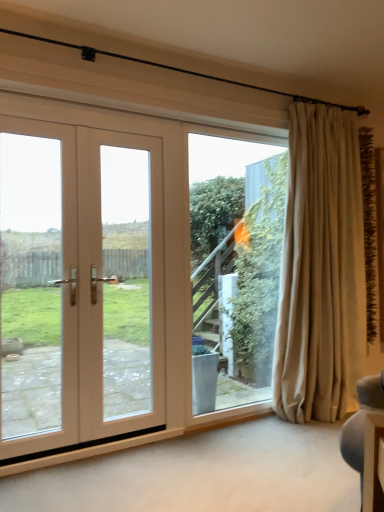
In order to click on white wood door at left in this screenshot , I will do `click(106, 277)`.

The width and height of the screenshot is (384, 512). Describe the element at coordinates (106, 277) in the screenshot. I see `white wood door at left` at that location.

This screenshot has height=512, width=384. Describe the element at coordinates (236, 264) in the screenshot. I see `transparent glass window at center` at that location.

Image resolution: width=384 pixels, height=512 pixels. I want to click on white wood door at left, so click(x=106, y=277).

Is beige fabric curtain at right bigger than transparent glass window at center?

Yes.

Can you confirm if beige fabric curtain at right is taller than transparent glass window at center?

Yes.

Is transparent glass window at center completely or partially inside beige fabric curtain at right?

No, beige fabric curtain at right does not contain transparent glass window at center.

Is white wood door at left bigger than transparent glass window at center?

Yes.

Find the location of a particular element. window screen located below the white wood door at left (from the image's perspective) is located at coordinates (236, 264).

Is white wood door at left facing towards transparent glass window at center?

No, white wood door at left is not aimed at transparent glass window at center.

From the picture: From the image's perspective, which is above, white wood door at left or transparent glass window at center?

From the image's view, white wood door at left is above.

Is beige fabric curtain at right shorter than white wood door at left?

No, beige fabric curtain at right is not shorter than white wood door at left.

Does point (311, 195) come closer to viewer compared to point (68, 368)?

No, (311, 195) is behind (68, 368).

From the image's perspective, between beige fabric curtain at right and white wood door at left, who is located below?

white wood door at left.

Can you confirm if beige fabric curtain at right is smaller than white wood door at left?

Actually, beige fabric curtain at right might be larger than white wood door at left.

This screenshot has width=384, height=512. What are the coordinates of `door in front of the transparent glass window at center` in the screenshot? It's located at (106, 277).

From the image's perspective, is transparent glass window at center above or below white wood door at left?

From the image's perspective, transparent glass window at center appears below white wood door at left.

Consider the image. Does transparent glass window at center contain white wood door at left?

No, white wood door at left is not surrounded by transparent glass window at center.

Is the position of transparent glass window at center less distant than that of white wood door at left?

No, transparent glass window at center is further to the viewer.

From a real-world perspective, between transparent glass window at center and beige fabric curtain at right, who is vertically lower?

transparent glass window at center, from a real-world perspective.

Is transparent glass window at center taller than beige fabric curtain at right?

Incorrect, the height of transparent glass window at center is not larger of that of beige fabric curtain at right.

Can beige fabric curtain at right be found inside transparent glass window at center?

Definitely not — beige fabric curtain at right is not inside transparent glass window at center.

From the image's perspective, who appears lower, transparent glass window at center or beige fabric curtain at right?

transparent glass window at center.

Could you tell me if white wood door at left is turned towards beige fabric curtain at right?

No, white wood door at left is not oriented towards beige fabric curtain at right.

From a real-world perspective, is white wood door at left positioned above or below beige fabric curtain at right?

In terms of real-world spatial position, white wood door at left is below beige fabric curtain at right.

Is white wood door at left next to beige fabric curtain at right?

There is a gap between white wood door at left and beige fabric curtain at right.

Find the location of `window screen below the beige fabric curtain at right (from a real-world perspective)`. window screen below the beige fabric curtain at right (from a real-world perspective) is located at coordinates (236, 264).

Find the location of a particular element. The height and width of the screenshot is (512, 384). window screen on the right of white wood door at left is located at coordinates (236, 264).

From the image, which object appears to be nearer to beige fabric curtain at right, transparent glass window at center or white wood door at left?

Among the two, transparent glass window at center is located nearer to beige fabric curtain at right.

Based on their spatial positions, is beige fabric curtain at right or white wood door at left further from transparent glass window at center?

white wood door at left lies further to transparent glass window at center than the other object.

Considering their positions, is white wood door at left positioned closer to transparent glass window at center than beige fabric curtain at right?

beige fabric curtain at right lies closer to transparent glass window at center than the other object.

Considering their positions, is white wood door at left positioned further to beige fabric curtain at right than transparent glass window at center?

white wood door at left.

Which object lies nearer to the anchor point white wood door at left, transparent glass window at center or beige fabric curtain at right?

transparent glass window at center is closer to white wood door at left.

Which object lies nearer to the anchor point white wood door at left, beige fabric curtain at right or transparent glass window at center?

Among the two, transparent glass window at center is located nearer to white wood door at left.

Image resolution: width=384 pixels, height=512 pixels. I want to click on window screen situated between white wood door at left and beige fabric curtain at right from left to right, so click(236, 264).